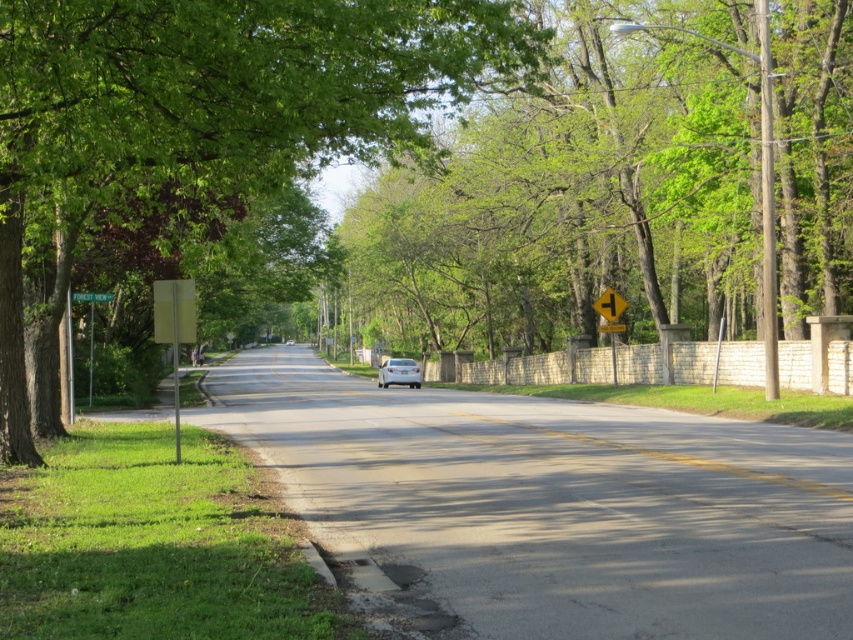
Question: Which point is closer to the camera taking this photo?

Choices:
 (A) (599, 308)
 (B) (753, 282)
 (C) (288, 339)
 (D) (381, 369)

Answer: (A)

Question: Can you confirm if green leafy tree at left is positioned below white glossy sedan at center?

Choices:
 (A) no
 (B) yes

Answer: (A)

Question: Which object is the closest to the green leafy tree at left?

Choices:
 (A) white glossy sedan at center
 (B) yellow reflective plastic at center
 (C) yellow painted line at center

Answer: (C)

Question: Estimate the real-world distances between objects in this image. Which object is closer to the yellow reflective plastic at center?

Choices:
 (A) green metallic street sign at left
 (B) green wooden sign at upper center
 (C) white glossy car at center

Answer: (B)

Question: Is green leafy tree at center below white glossy car at center?

Choices:
 (A) yes
 (B) no

Answer: (B)

Question: Can you confirm if green leafy tree at center is wider than yellow reflective plastic at center?

Choices:
 (A) yes
 (B) no

Answer: (A)